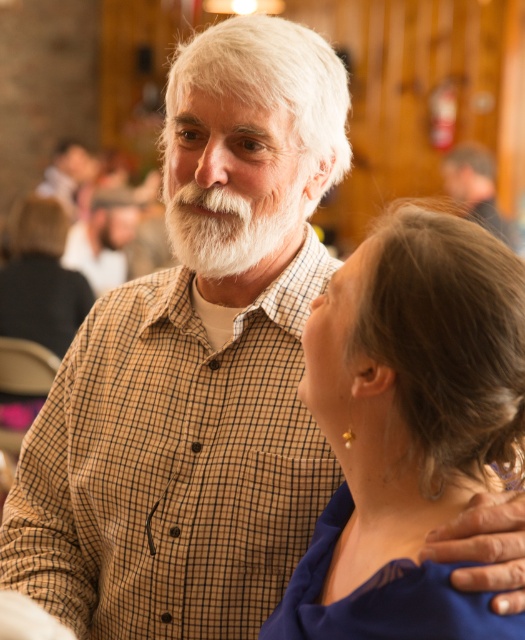
You are an artist trying to draw the scene. You need to place the white fluffy beard at center accurately. According to the coordinates provided, where should you position it?

The white fluffy beard at center should be positioned at coordinates point 0.356 on the x axis and 0.432 on the y axis.

You are a photographer trying to capture a closeup of the brown plaid shirt at upper right without the matte brown shirt at upper left being visible in the background. Is this possible based on their positions?

Yes, the brown plaid shirt at upper right is in front of the matte brown shirt at upper left, so you can focus on the brown plaid shirt at upper right and exclude the matte brown shirt at upper left from the background.